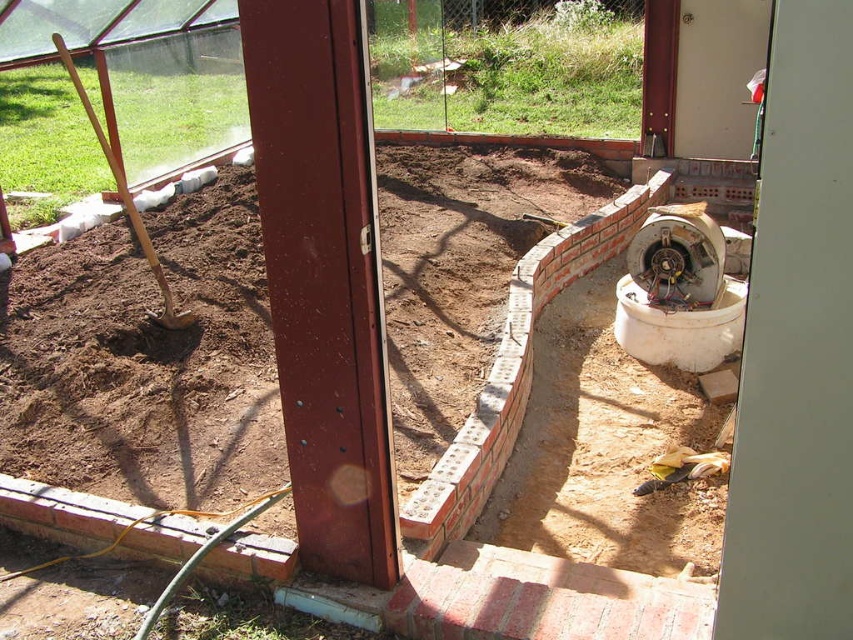
You are a gardener who wants to plant a flower in the brown soil at center. Where exactly should you dig?

→ The brown soil at center is located at point (146, 362), so you should dig there.

You are a gardener who needs to plant a tall sunflower. The sunflower requires the soil to be at least 20 cm deep. Can you determine if the brown soil at center has sufficient depth based on its height compared to the metallic red pillar at center?

The brown soil at center is taller than the metallic red pillar at center. Since the pillar is metallic and likely has a standard height, the soil depth is sufficient for planting the sunflower.